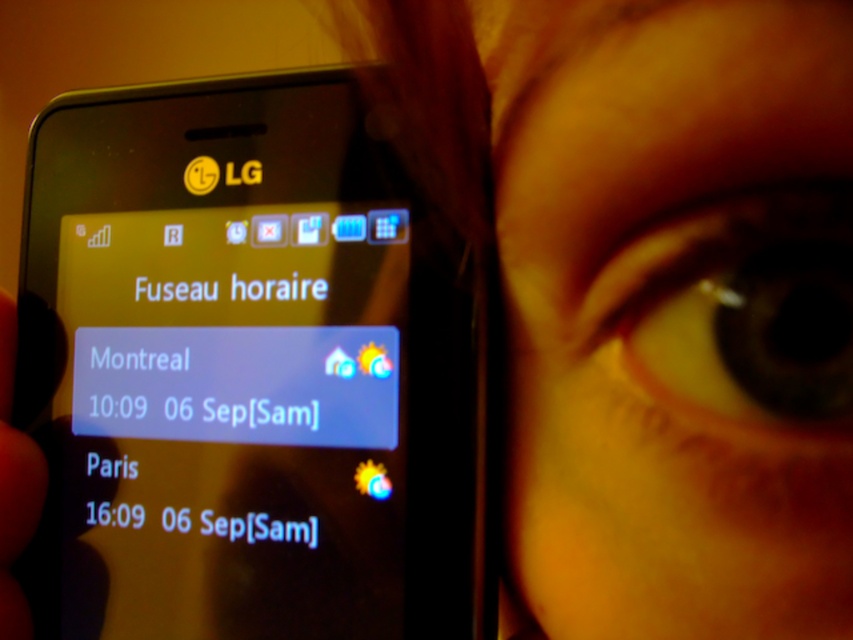
Who is shorter, black glossy smartphone at center or yellow matte eye at upper right?

yellow matte eye at upper right is shorter.

The width and height of the screenshot is (853, 640). What do you see at coordinates (247, 372) in the screenshot?
I see `black glossy smartphone at center` at bounding box center [247, 372].

Is point (367, 144) behind point (636, 365)?

Yes, it is behind point (636, 365).

Locate an element on the screen. This screenshot has height=640, width=853. black glossy smartphone at center is located at coordinates (247, 372).

Who is positioned more to the right, yellow skin at center or matte black phone at left?

Positioned to the right is yellow skin at center.

Who is lower down, yellow skin at center or matte black phone at left?

matte black phone at left is lower down.

Is point (757, 209) more distant than point (4, 588)?

No, (757, 209) is in front of (4, 588).

The height and width of the screenshot is (640, 853). What are the coordinates of `yellow skin at center` in the screenshot? It's located at (653, 300).

Does black glossy smartphone at center come behind matte black phone at left?

That is False.

Between black glossy smartphone at center and matte black phone at left, which one appears on the left side from the viewer's perspective?

matte black phone at left is more to the left.

The image size is (853, 640). What do you see at coordinates (247, 372) in the screenshot?
I see `black glossy smartphone at center` at bounding box center [247, 372].

Where is `black glossy smartphone at center`? Image resolution: width=853 pixels, height=640 pixels. black glossy smartphone at center is located at coordinates (247, 372).